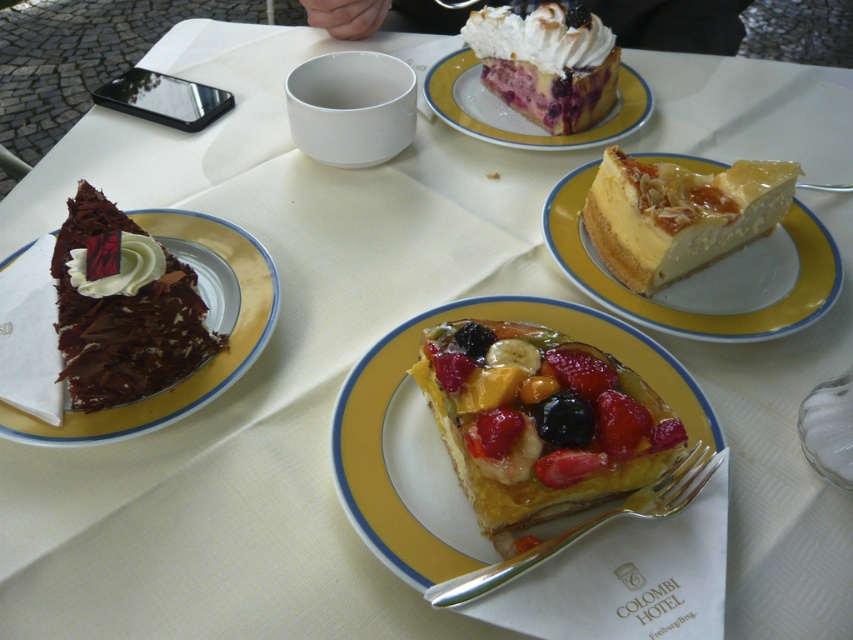
Who is taller, smooth chocolate cake at left or yellow glazed plate at upper center?

Standing taller between the two is yellow glazed plate at upper center.

You are a GUI agent. You are given a task and a screenshot of the screen. Output one action in this format:
    pyautogui.click(x=<x>, y=<y>)
    Task: Click on the smooth chocolate cake at left
    The height and width of the screenshot is (640, 853).
    Given the screenshot: What is the action you would take?
    pyautogui.click(x=125, y=317)

Who is more forward, [693,330] or [468,573]?

Point [468,573] is in front.

Does point (584, 228) lie behind point (676, 474)?

Yes, it is behind point (676, 474).

Does point (648, 156) come farther from viewer compared to point (526, 566)?

Yes, it is behind point (526, 566).

I want to click on smooth white cheesecake at right, so click(706, 275).

Which of these two, glossy fruit-topped tart at center or whipped cream topped pie at upper center, stands shorter?

With less height is glossy fruit-topped tart at center.

Does point (592, 419) come in front of point (614, 51)?

Yes, it is.

Between point (630, 385) and point (578, 64), which one is positioned behind?

The point (578, 64) is more distant.

You are a GUI agent. You are given a task and a screenshot of the screen. Output one action in this format:
    pyautogui.click(x=<x>, y=<y>)
    Task: Click on the glossy fruit-topped tart at center
    The image size is (853, 640).
    Given the screenshot: What is the action you would take?
    pyautogui.click(x=540, y=419)